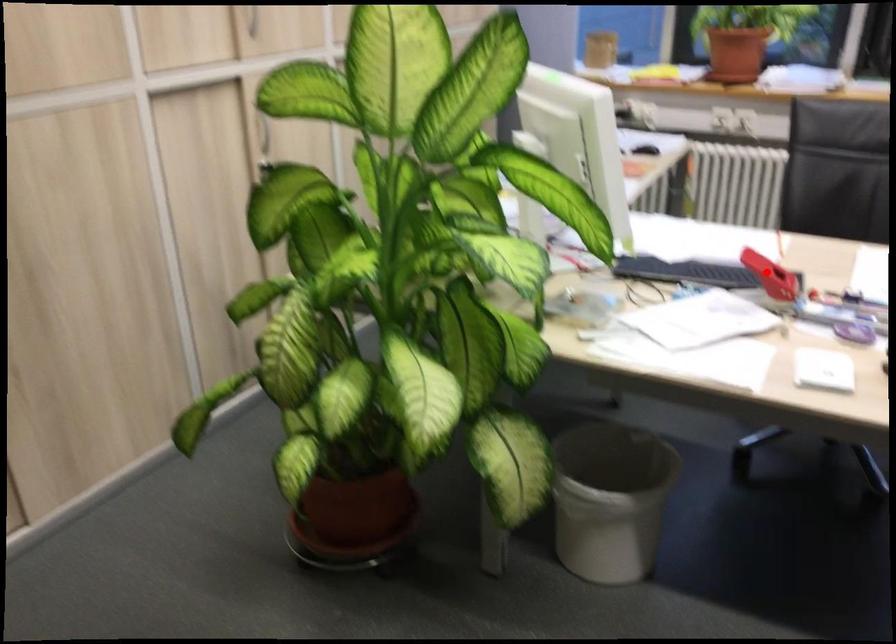
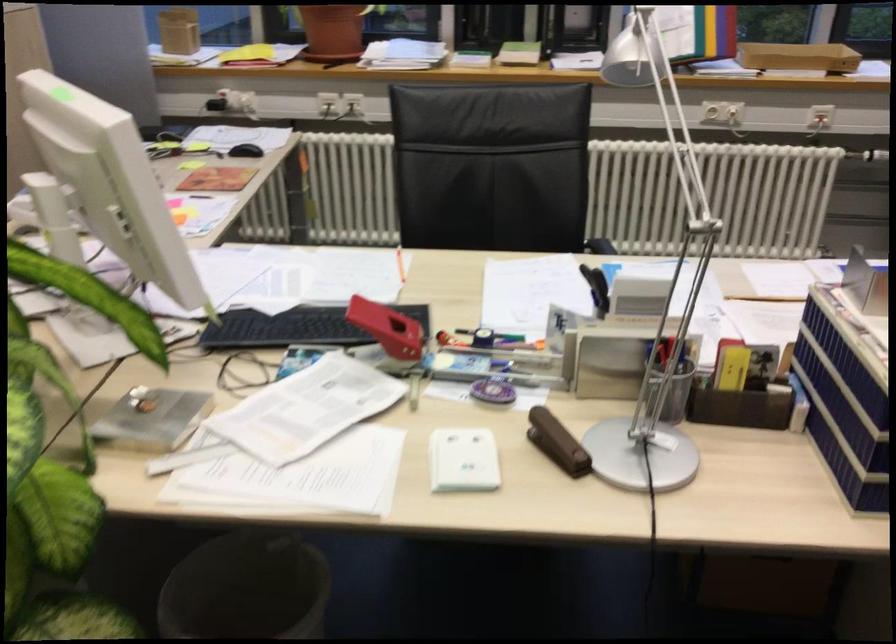
Question: I am providing you with two images of the same scene from different viewpoints. A red point is shown in image1. For the corresponding object point in image2, is it positioned nearer or farther from the camera?

Choices:
 (A) Nearer
 (B) Farther

Answer: (A)